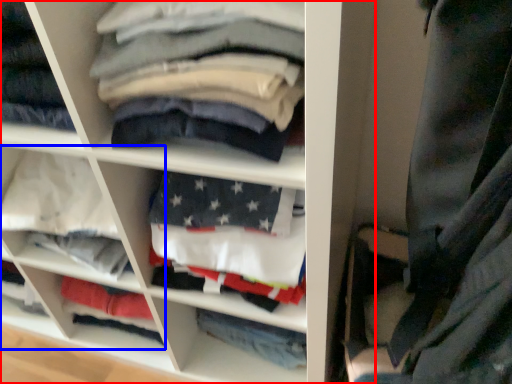
Question: Which object is closer to the camera taking this photo, shelf (highlighted by a red box) or cabinet (highlighted by a blue box)?

Choices:
 (A) shelf
 (B) cabinet

Answer: (A)